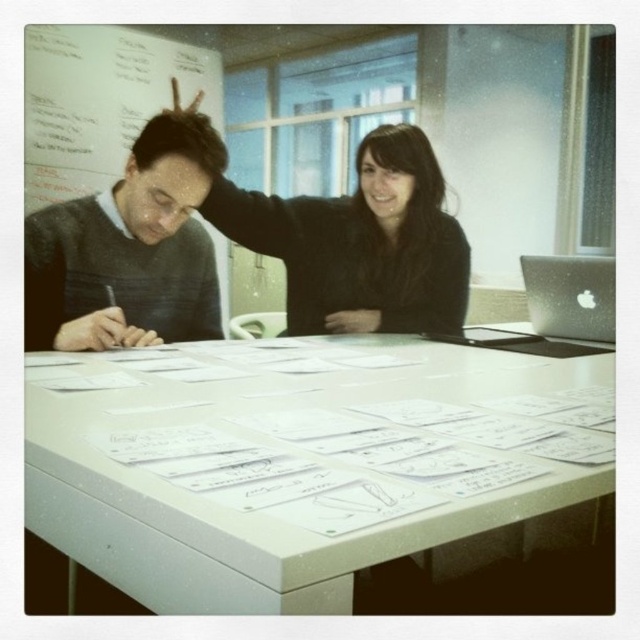
You are a delivery robot that needs to place a small package between the white plastic table at center and the gray sweater at left. Can you fit the package there if it measures 16 inches in length?

The distance between the white plastic table at center and the gray sweater at left is 16.29 inches. Since the package is 16 inches long, it should fit comfortably within the space.

You are organizing a presentation and need to place the black matte sweater at upper center and the silver metallic laptop at upper right on a shelf. If the shelf has limited height space, which object might not fit and why?

The black matte sweater at upper center is much taller than the silver metallic laptop at upper right, so it might not fit on the shelf with limited height space.